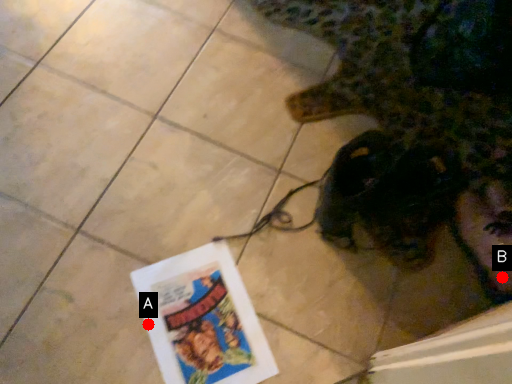
Question: Two points are circled on the image, labeled by A and B beside each circle. Which of the following is the closest to the observer?

Choices:
 (A) A is closer
 (B) B is closer

Answer: (A)